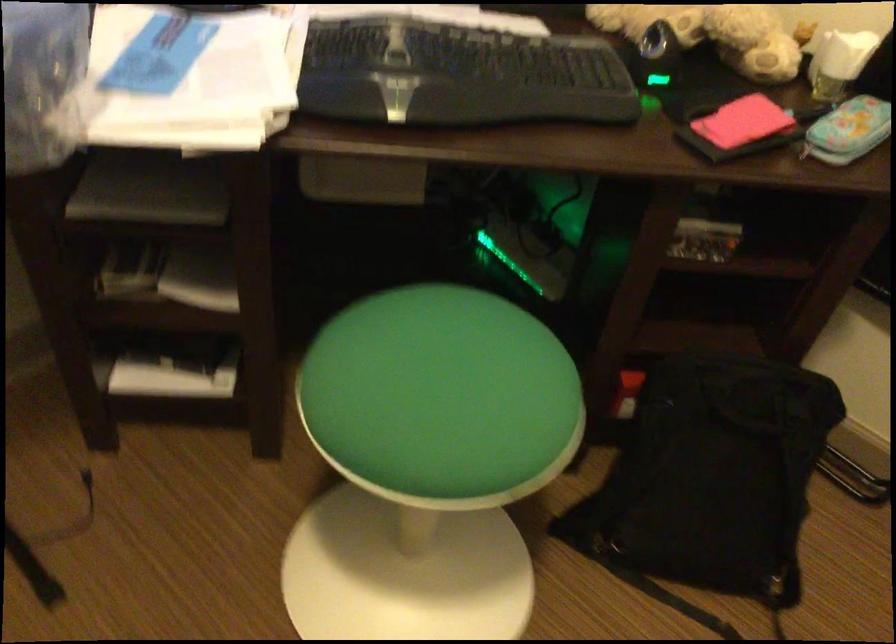
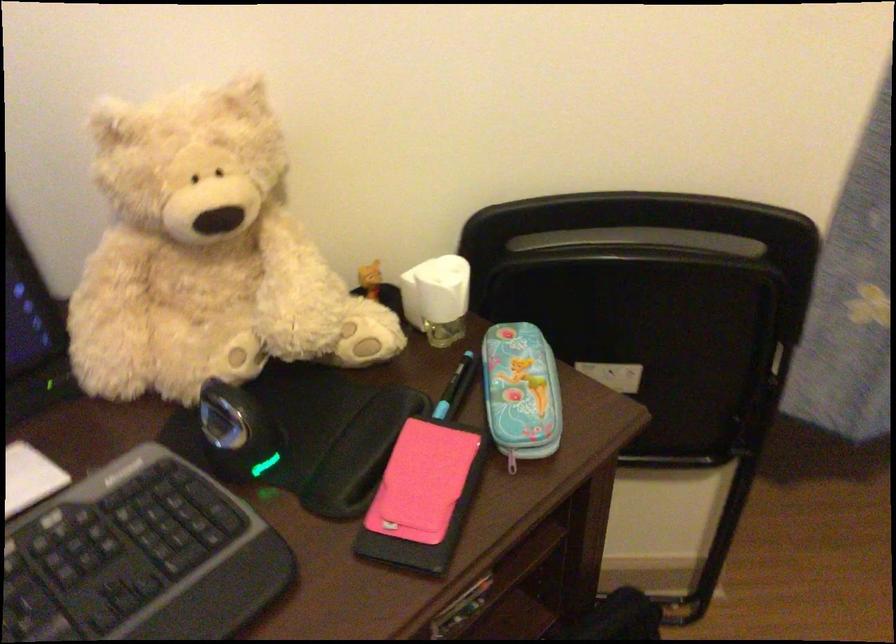
Find the pixel in the second image that matches point 800,147 in the first image.

(512, 460)